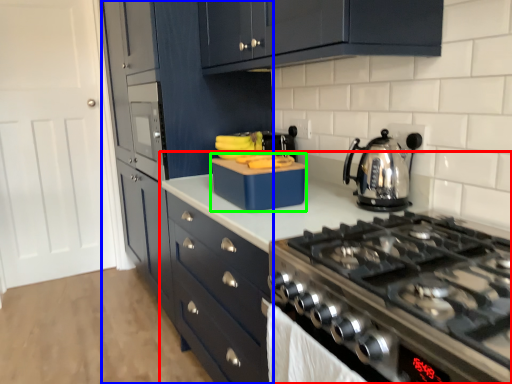
Question: Which object is the farthest from countertop (highlighted by a red box)? Choose among these: cabinetry (highlighted by a blue box) or kitchen appliance (highlighted by a green box).

Choices:
 (A) cabinetry
 (B) kitchen appliance

Answer: (A)